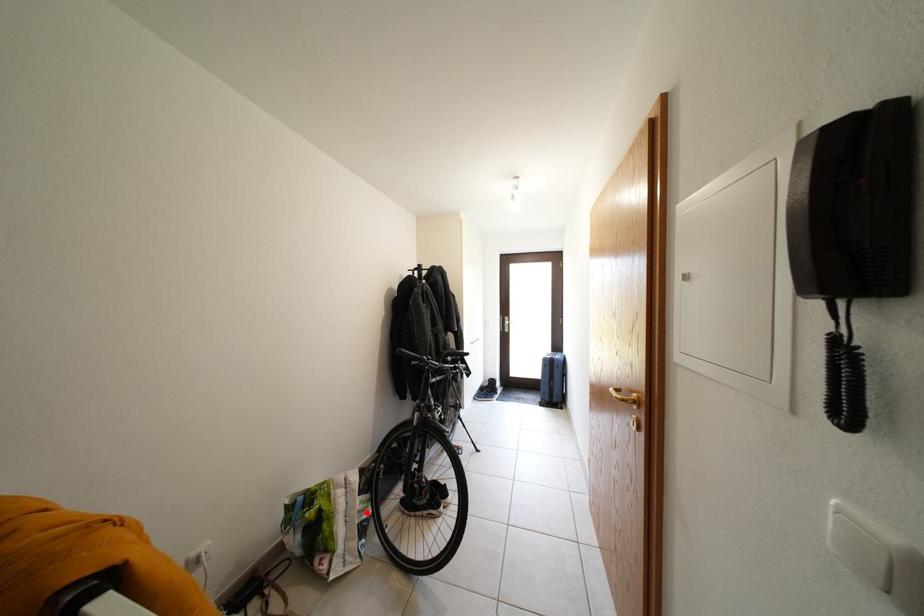
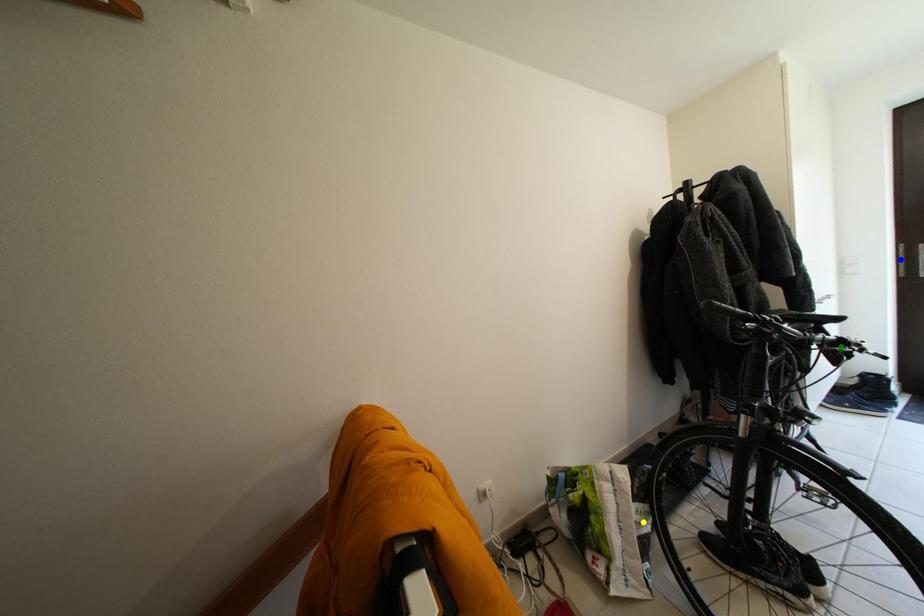
Question: I am providing you with two images of the same scene from different viewpoints. A red point is marked on the first image. You are given multiple points on the second image. In image 2, which mark is for the same physical point as the one in image 1?

Choices:
 (A) yellow point
 (B) blue point
 (C) green point

Answer: (A)